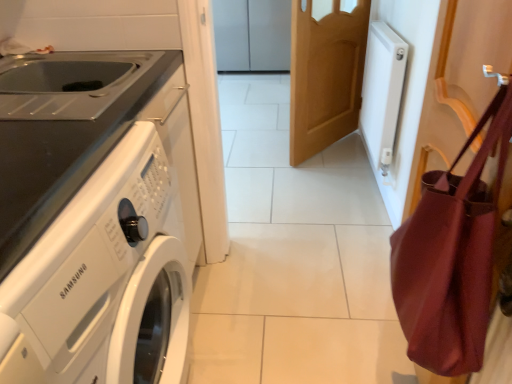
Question: From the image's perspective, is white glossy washing machine at left below matte burgundy shoulder bag at right?

Choices:
 (A) yes
 (B) no

Answer: (A)

Question: Does white glossy washing machine at left have a larger size compared to matte burgundy shoulder bag at right?

Choices:
 (A) no
 (B) yes

Answer: (B)

Question: From the image's perspective, is white glossy washing machine at left located above matte burgundy shoulder bag at right?

Choices:
 (A) yes
 (B) no

Answer: (B)

Question: Is white glossy washing machine at left positioned before matte burgundy shoulder bag at right?

Choices:
 (A) no
 (B) yes

Answer: (B)

Question: Is white glossy washing machine at left smaller than matte burgundy shoulder bag at right?

Choices:
 (A) yes
 (B) no

Answer: (B)

Question: From a real-world perspective, is white glossy washing machine at left beneath matte burgundy shoulder bag at right?

Choices:
 (A) yes
 (B) no

Answer: (A)

Question: Is light brown wooden door at center in front of white glossy cabinet at upper center?

Choices:
 (A) yes
 (B) no

Answer: (A)

Question: Is light brown wooden door at center to the left of white glossy cabinet at upper center from the viewer's perspective?

Choices:
 (A) yes
 (B) no

Answer: (B)

Question: Is light brown wooden door at center thinner than white glossy cabinet at upper center?

Choices:
 (A) no
 (B) yes

Answer: (B)

Question: From a real-world perspective, is light brown wooden door at center positioned over white glossy cabinet at upper center based on gravity?

Choices:
 (A) no
 (B) yes

Answer: (B)

Question: From the image's perspective, is light brown wooden door at center under white glossy cabinet at upper center?

Choices:
 (A) yes
 (B) no

Answer: (A)

Question: Is light brown wooden door at center not near white glossy cabinet at upper center?

Choices:
 (A) yes
 (B) no

Answer: (A)

Question: Is the depth of white glossy washing machine at left greater than that of metallic stainless steel sink at left?

Choices:
 (A) yes
 (B) no

Answer: (B)